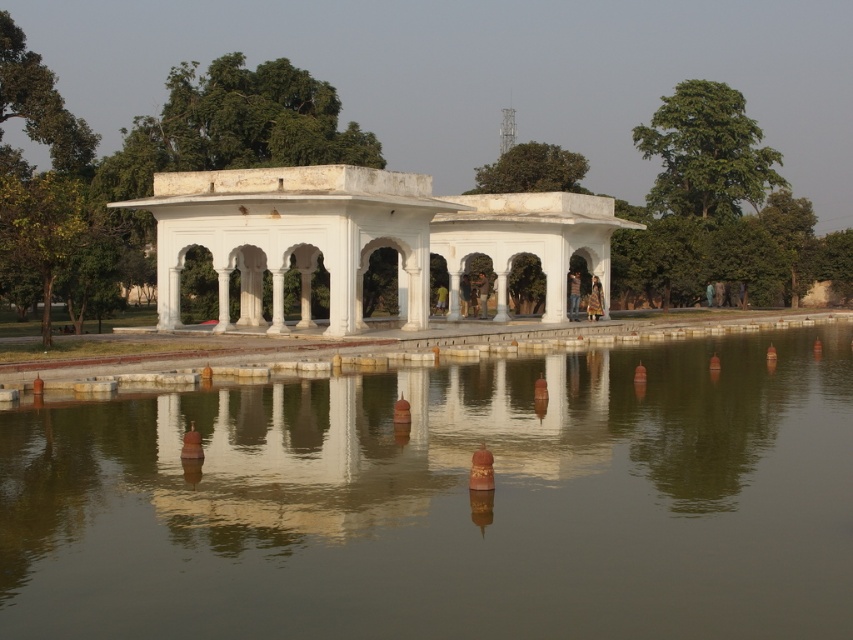
You are standing in the pavilion and notice the smooth reflective water at center and the brown leather jacket at center. Which object is taller when viewed from your position?

The brown leather jacket at center is taller than the smooth reflective water at center.

You are standing in the serene scene and want to place your brown leather jacket on the white marble gazebo. Based on their positions, which direction should you move to place the brown leather jacket at center onto the white marble gazebo at center?

The white marble gazebo at center is to the left of the brown leather jacket at center, so you should move to your left to place the brown leather jacket at center onto the white marble gazebo at center.

What are the coordinates of the white marble gazebo at center in the image?

The white marble gazebo at center is located at coordinates (360,237).